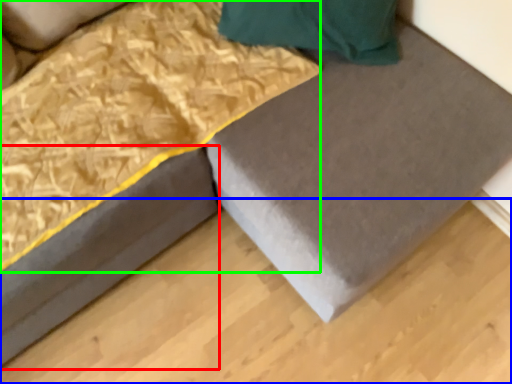
Question: Considering the real-world distances, which object is farthest from bed frame (highlighted by a red box)? plywood (highlighted by a blue box) or blanket (highlighted by a green box)?

Choices:
 (A) plywood
 (B) blanket

Answer: (A)